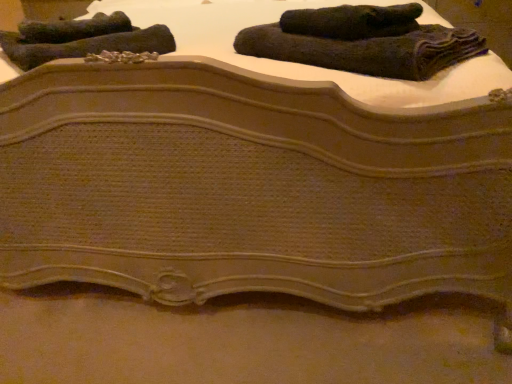
Question: Is dark gray textured towel at upper left, which is counted as the fourth towel, starting from the right, oriented towards dark woolen towel at upper right, which is the second towel in right-to-left order?

Choices:
 (A) yes
 (B) no

Answer: (B)

Question: Can we say dark gray textured towel at upper left, which is counted as the fourth towel, starting from the right, lies outside dark woolen towel at upper right, which is the second towel in right-to-left order?

Choices:
 (A) no
 (B) yes

Answer: (B)

Question: Considering the relative positions of dark gray textured towel at upper left, which is counted as the fourth towel, starting from the right, and dark woolen towel at upper right, which appears as the third towel when viewed from the left, in the image provided, is dark gray textured towel at upper left, which is counted as the fourth towel, starting from the right, to the left of dark woolen towel at upper right, which appears as the third towel when viewed from the left, from the viewer's perspective?

Choices:
 (A) no
 (B) yes

Answer: (B)

Question: Is dark gray textured towel at upper left, which is counted as the fourth towel, starting from the right, closer to the viewer compared to dark woolen towel at upper right, which is the second towel in right-to-left order?

Choices:
 (A) no
 (B) yes

Answer: (A)

Question: Can you confirm if dark gray textured towel at upper left, which is counted as the fourth towel, starting from the right, is shorter than dark woolen towel at upper right, which appears as the third towel when viewed from the left?

Choices:
 (A) no
 (B) yes

Answer: (A)

Question: Is dark gray textured towel at upper left, which is counted as the fourth towel, starting from the right, placed right next to dark woolen towel at upper right, which is the second towel in right-to-left order?

Choices:
 (A) no
 (B) yes

Answer: (A)

Question: Are dark green textured towel at upper left, the second towel viewed from the left, and dark gray textured towel at upper left, the first towel viewed from the left, far apart?

Choices:
 (A) yes
 (B) no

Answer: (B)

Question: Is dark green textured towel at upper left, the second towel viewed from the left, further to the viewer compared to dark gray textured towel at upper left, which is counted as the fourth towel, starting from the right?

Choices:
 (A) no
 (B) yes

Answer: (A)

Question: Is dark green textured towel at upper left, which ranks as the third towel in right-to-left order, looking in the opposite direction of dark gray textured towel at upper left, the first towel viewed from the left?

Choices:
 (A) yes
 (B) no

Answer: (B)

Question: Is dark green textured towel at upper left, which ranks as the third towel in right-to-left order, at the right side of dark gray textured towel at upper left, which is counted as the fourth towel, starting from the right?

Choices:
 (A) no
 (B) yes

Answer: (B)

Question: Can you confirm if dark green textured towel at upper left, the second towel viewed from the left, is thinner than dark gray textured towel at upper left, which is counted as the fourth towel, starting from the right?

Choices:
 (A) no
 (B) yes

Answer: (A)

Question: Is dark green textured towel at upper left, which ranks as the third towel in right-to-left order, completely or partially outside of dark gray textured towel at upper left, the first towel viewed from the left?

Choices:
 (A) no
 (B) yes

Answer: (B)

Question: Is dark green textured towel at upper left, which ranks as the third towel in right-to-left order, smaller than dark woolen towel at upper right, which appears as the third towel when viewed from the left?

Choices:
 (A) yes
 (B) no

Answer: (B)